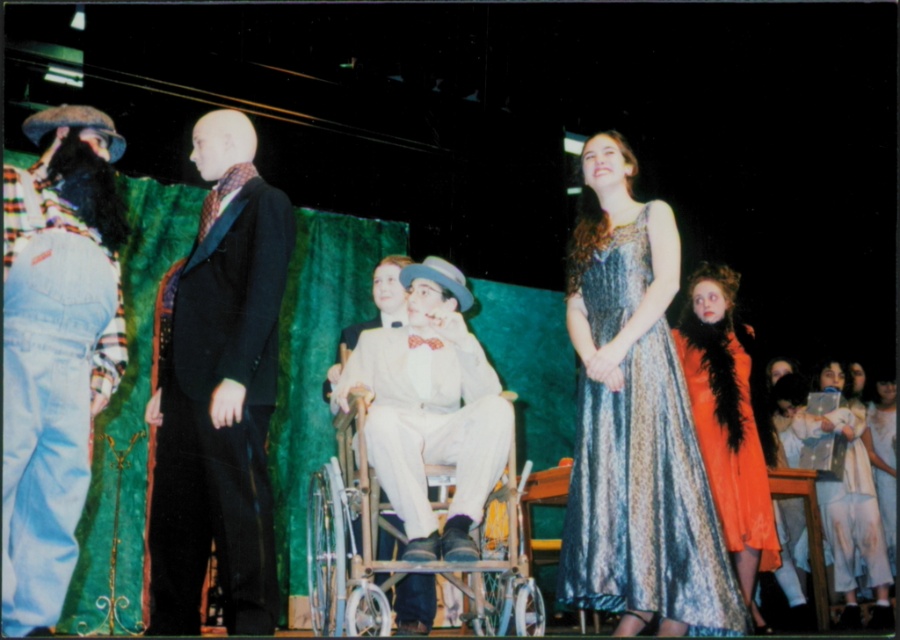
How far apart are white satin suit at center and white lace dress at lower right?

They are 3.13 meters apart.

This screenshot has height=640, width=900. What do you see at coordinates (430, 410) in the screenshot?
I see `white satin suit at center` at bounding box center [430, 410].

Does point (366, 448) come closer to viewer compared to point (829, 492)?

Yes, it is.

Find the location of `white satin suit at center`. white satin suit at center is located at coordinates (430, 410).

Which of these two, matte black suit at center or denim jeans at left, stands taller?

matte black suit at center

Does matte black suit at center have a greater width compared to denim jeans at left?

Indeed, matte black suit at center has a greater width compared to denim jeans at left.

Between point (208, 481) and point (32, 484), which one is positioned in front?

Positioned in front is point (32, 484).

Locate an element on the screen. The width and height of the screenshot is (900, 640). matte black suit at center is located at coordinates (219, 392).

Can you confirm if matte black suit at center is taller than shiny metallic dress at center?

Indeed, matte black suit at center has a greater height compared to shiny metallic dress at center.

Which is in front, point (207, 317) or point (662, 371)?

Positioned in front is point (207, 317).

Locate an element on the screen. This screenshot has height=640, width=900. matte black suit at center is located at coordinates (219, 392).